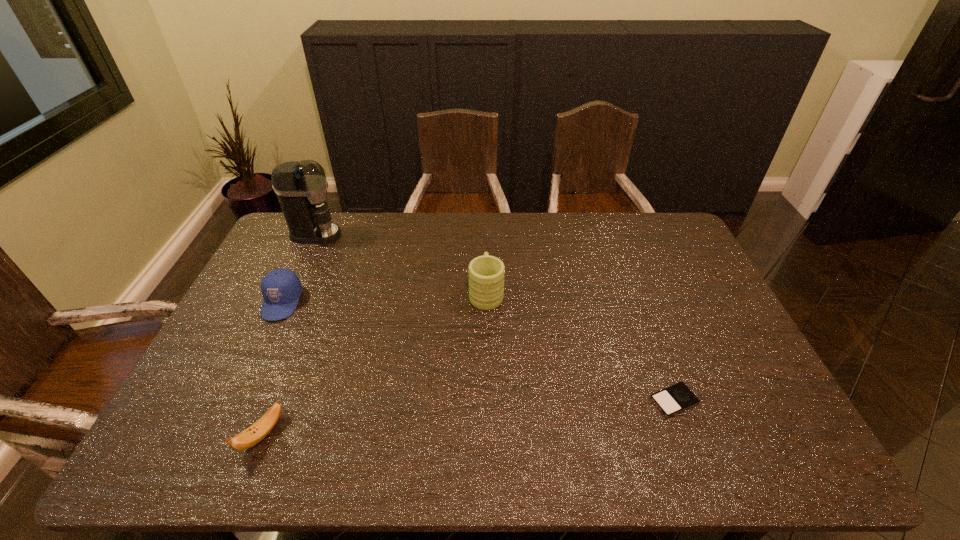
Identify the location of vacant point located between the rightmost object and the cap. (478, 352).

The image size is (960, 540). What are the coordinates of `vacant space that's between the farthest object and the fourth object from left to right` in the screenshot? It's located at (400, 264).

Find the location of a particular element. empty space between the cap and the mug is located at coordinates (384, 298).

You are a GUI agent. You are given a task and a screenshot of the screen. Output one action in this format:
    pyautogui.click(x=<x>, y=<y>)
    Task: Click on the vacant area between the fourth object from left to right and the second shortest object
    This screenshot has height=540, width=960.
    Given the screenshot: What is the action you would take?
    pyautogui.click(x=374, y=363)

You are a GUI agent. You are given a task and a screenshot of the screen. Output one action in this format:
    pyautogui.click(x=<x>, y=<y>)
    Task: Click on the blank region between the coffee maker and the fourth object from left to right
    Image resolution: width=960 pixels, height=540 pixels.
    Given the screenshot: What is the action you would take?
    pyautogui.click(x=400, y=264)

I want to click on vacant space that's between the shortest object and the second shortest object, so click(x=468, y=417).

Identify which object is located as the fourth nearest to the shortest object. Please provide its 2D coordinates. Your answer should be formatted as a tuple, i.e. [(x, y)], where the tuple contains the x and y coordinates of a point satisfying the conditions above.

[(301, 187)]

Choose which object is the fourth nearest neighbor to the banana. Please provide its 2D coordinates. Your answer should be formatted as a tuple, i.e. [(x, y)], where the tuple contains the x and y coordinates of a point satisfying the conditions above.

[(678, 397)]

This screenshot has width=960, height=540. In order to click on vacant space that satisfies the following two spatial constraints: 1. place cup under the spout of the farthest object; 2. on the back side of the iPod in this screenshot , I will do `click(238, 401)`.

Identify the location of vacant space that satisfies the following two spatial constraints: 1. place cup under the spout of the farthest object; 2. on the back side of the fourth tallest object. This screenshot has width=960, height=540. (223, 434).